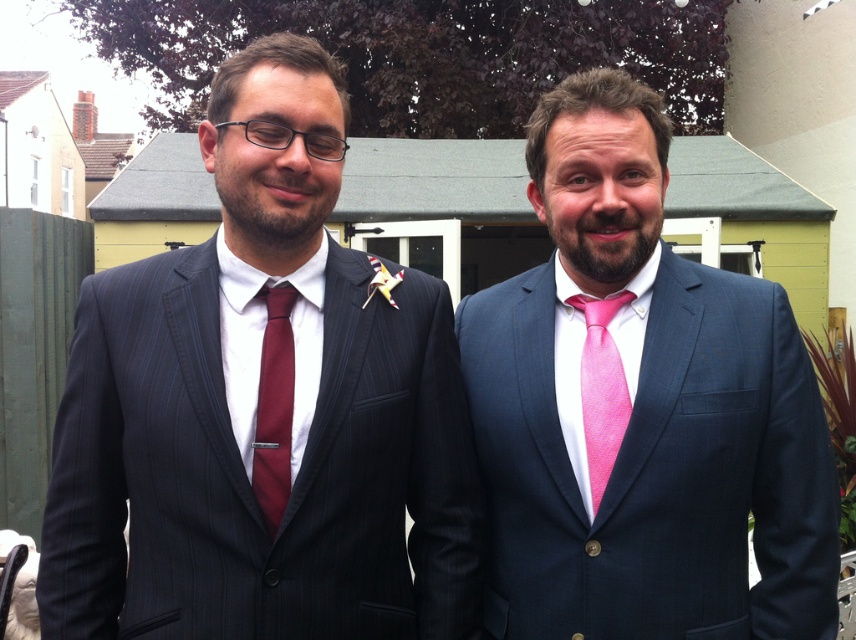
You are a photographer at a formal event. You need to capture a clear photo of the pink silk suit at center and the burgundy silk tie at center. Which one is partially hidden by the other?

The burgundy silk tie at center is partially hidden by the pink silk suit at center because it is positioned behind it.

You are a tailor who needs to determine which item requires more fabric for alterations between the pink silk suit at center and the pink satin tie at right. Which item would need more fabric?

The pink silk suit at center requires more fabric than the pink satin tie at right because its width is larger, indicating it uses more material.

You are an event planner trying to place a 1.2 meter wide banner between the pink silk suit at center and the shed. Is there enough space?

The position of pink silk suit at center is at point (x=640, y=410), but without knowing the shed position, it is impossible to determine the distance between them. Please provide more information about the shed location.